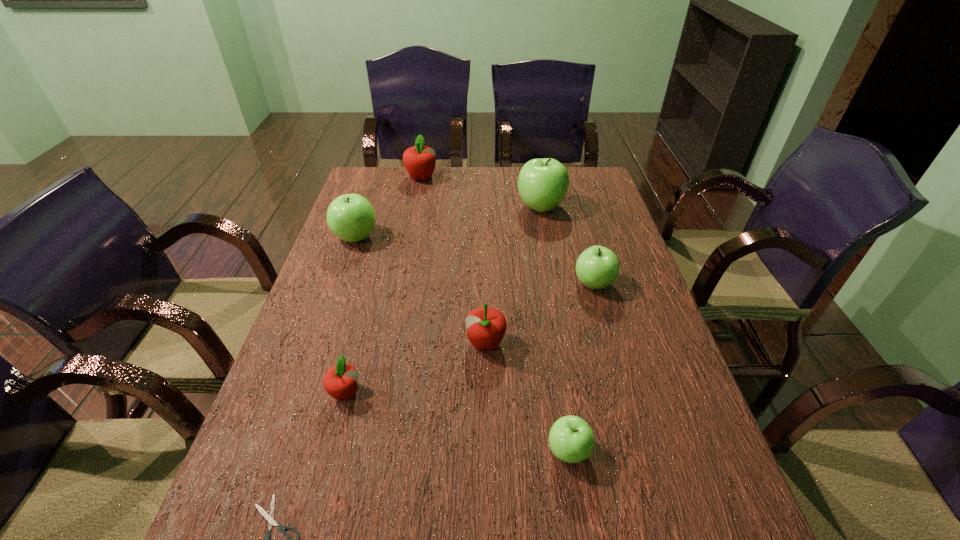
This screenshot has height=540, width=960. I want to click on the tallest object, so click(543, 183).

Where is `the farthest green apple`? Image resolution: width=960 pixels, height=540 pixels. the farthest green apple is located at coordinates (543, 183).

Locate an element on the screen. the farthest object is located at coordinates (419, 160).

Find the location of a particular element. This screenshot has width=960, height=540. the farthest red apple is located at coordinates (419, 160).

This screenshot has width=960, height=540. I want to click on the third smallest green apple, so click(x=351, y=217).

Find the location of a particular element. Image resolution: width=960 pixels, height=540 pixels. the leftmost green apple is located at coordinates (351, 217).

The height and width of the screenshot is (540, 960). I want to click on the second nearest green apple, so click(597, 267).

Locate an element on the screen. This screenshot has height=540, width=960. the fourth farthest object is located at coordinates tap(597, 267).

The height and width of the screenshot is (540, 960). Identify the location of the rightmost red apple. (486, 326).

Where is `the fourth nearest object`? the fourth nearest object is located at coordinates (486, 326).